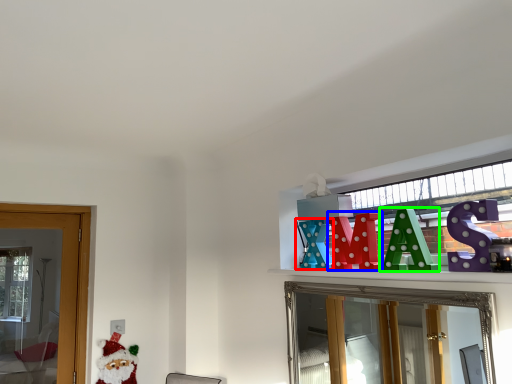
Question: Which object is positioned closest to toy (highlighted by a red box)? Select from toy (highlighted by a blue box) and toy (highlighted by a green box).

Choices:
 (A) toy
 (B) toy

Answer: (A)